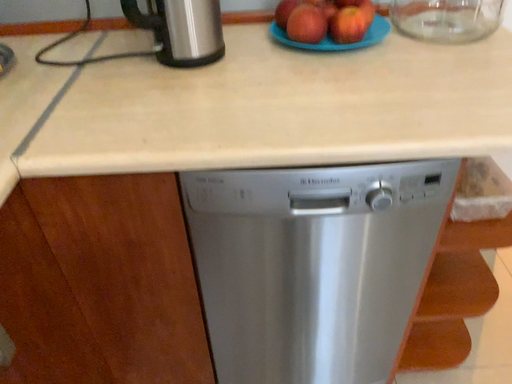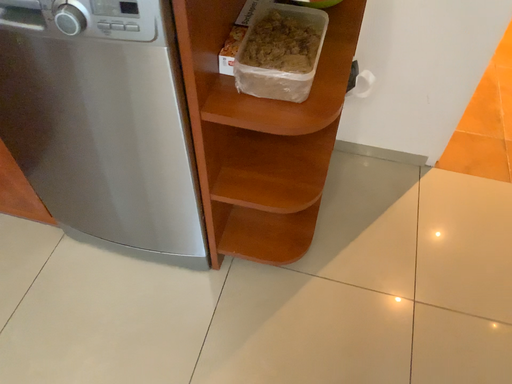
Question: How did the camera likely rotate when shooting the video?

Choices:
 (A) rotated downward
 (B) rotated upward

Answer: (A)